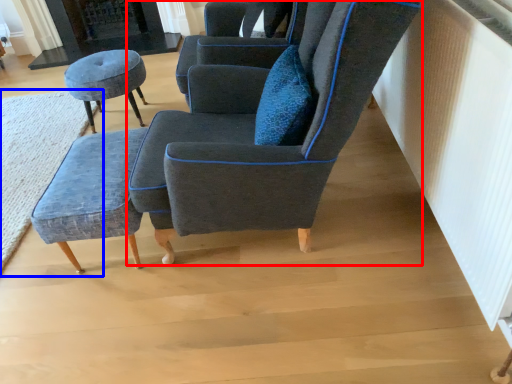
Question: Which point is closer to the camera, chair (highlighted by a red box) or mat (highlighted by a blue box)?

Choices:
 (A) chair
 (B) mat

Answer: (A)